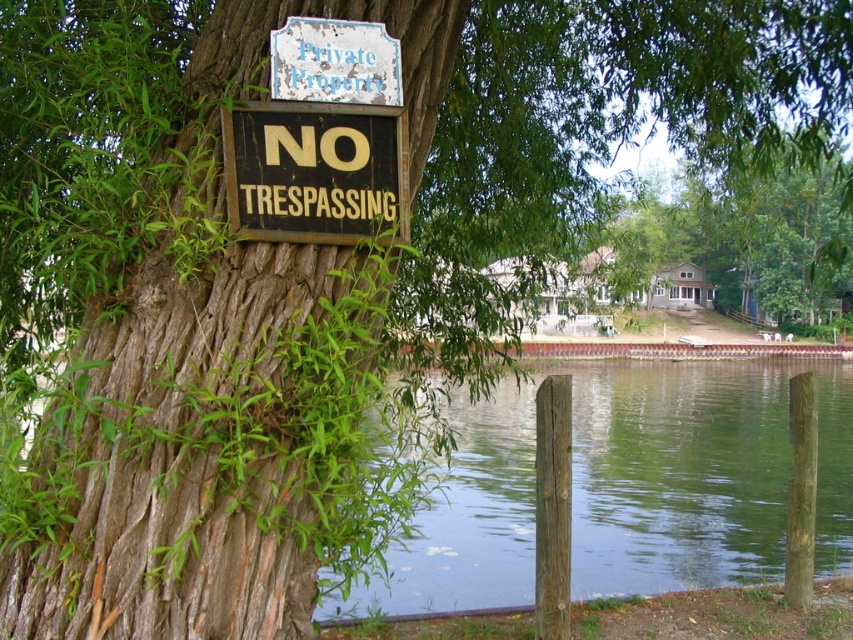
Who is shorter, green water at lower center or black wood sign at upper center?

With less height is black wood sign at upper center.

Between point (515, 490) and point (396, 218), which one is positioned behind?

Point (515, 490)

Does point (751, 460) come in front of point (386, 208)?

No, it is behind (386, 208).

You are a GUI agent. You are given a task and a screenshot of the screen. Output one action in this format:
    pyautogui.click(x=<x>, y=<y>)
    Task: Click on the green water at lower center
    
    Given the screenshot: What is the action you would take?
    pyautogui.click(x=697, y=472)

Is black wood sign at upper center bigger than white faded wood sign at upper center?

Yes.

Between point (334, 193) and point (363, 52), which one is positioned behind?

The point (363, 52) is more distant.

I want to click on black wood sign at upper center, so click(x=315, y=172).

Who is taller, green water at lower center or white faded wood sign at upper center?

With more height is green water at lower center.

The height and width of the screenshot is (640, 853). What do you see at coordinates (697, 472) in the screenshot?
I see `green water at lower center` at bounding box center [697, 472].

Who is more distant from viewer, (648, 371) or (322, 86)?

Positioned behind is point (648, 371).

Where is `green water at lower center`? green water at lower center is located at coordinates (697, 472).